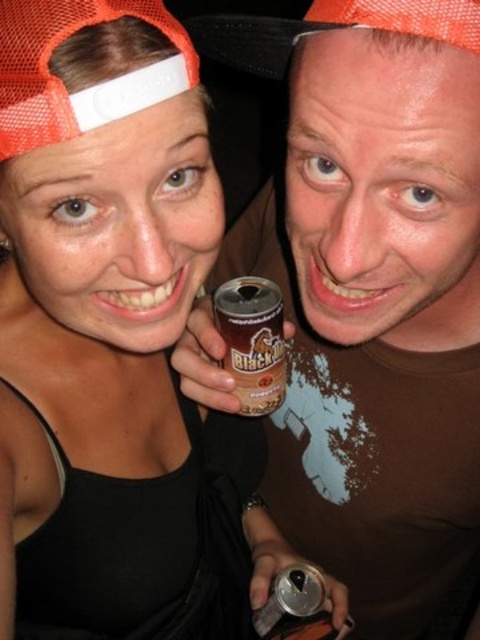
Where is `brown matte t-shirt at center`? The image size is (480, 640). brown matte t-shirt at center is located at coordinates [372, 292].

Between point (380, 268) and point (266, 344), which one is positioned in front?

Point (380, 268) is more forward.

Where is `brown matte t-shirt at center`? This screenshot has height=640, width=480. brown matte t-shirt at center is located at coordinates (372, 292).